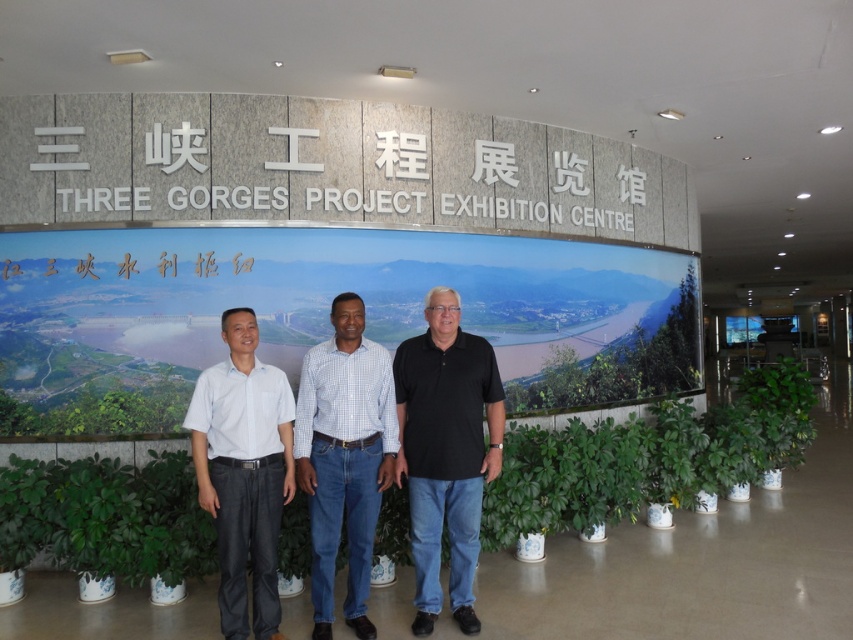
Question: Is green leafy plant at center in front of dark gray cotton shirt at center?

Choices:
 (A) yes
 (B) no

Answer: (B)

Question: Is the position of green leafy plant at center more distant than that of checkered fabric shirt at center?

Choices:
 (A) no
 (B) yes

Answer: (B)

Question: Considering the real-world distances, which object is farthest from the black cotton polo shirt at center?

Choices:
 (A) green leafy plant at center
 (B) dark gray cotton shirt at center

Answer: (A)

Question: Which point is closer to the camera?

Choices:
 (A) black cotton polo shirt at center
 (B) dark gray cotton shirt at center
 (C) green leafy plant at center
 (D) checkered fabric shirt at center

Answer: (B)

Question: Which object appears farthest from the camera in this image?

Choices:
 (A) green leafy plant at center
 (B) black cotton polo shirt at center

Answer: (A)

Question: Can you confirm if checkered fabric shirt at center is positioned to the left of dark gray cotton shirt at center?

Choices:
 (A) yes
 (B) no

Answer: (B)